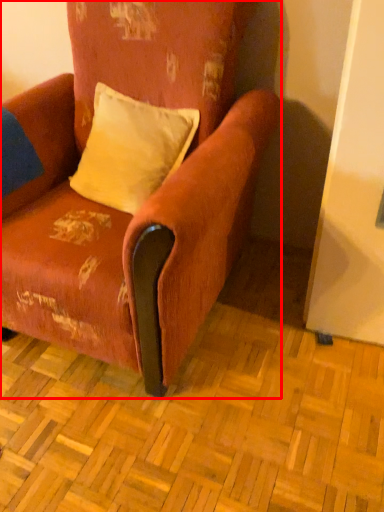
Question: Considering the relative positions of chair (annotated by the red box) and pillow in the image provided, where is chair (annotated by the red box) located with respect to the staircase?

Choices:
 (A) left
 (B) right

Answer: (A)